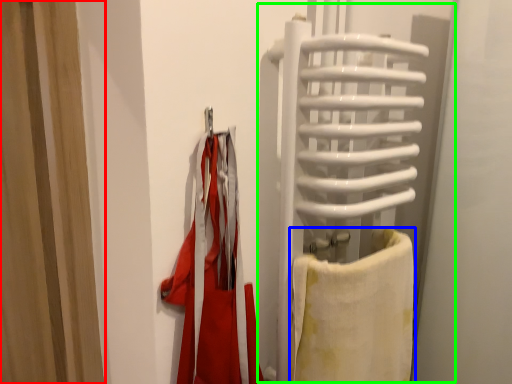
Question: Which object is the farthest from curtain (highlighted by a red box)? Choose among these: towel (highlighted by a blue box) or screen door (highlighted by a green box).

Choices:
 (A) towel
 (B) screen door

Answer: (A)